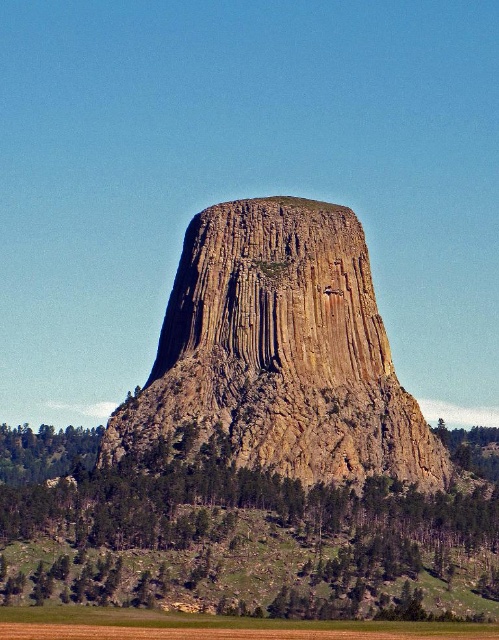
You are a hiker standing at the base of Devils Tower and notice two trees near you. One is labeled as green leafy trees at lower left and the other is green leafy tree at lower left. Which of these two trees is taller?

The green leafy trees at lower left is taller than the green leafy tree at lower left.

You are a hiker standing at the base of Devils Tower and notice two trees in the distance. One is labeled as green leafy trees at lower left and the other as green leafy tree at lower right. Which tree would appear closer to you based on their sizes?

The green leafy trees at lower left appears closer because it is larger in size than the green leafy tree at lower right, and objects closer to the observer generally appear larger.